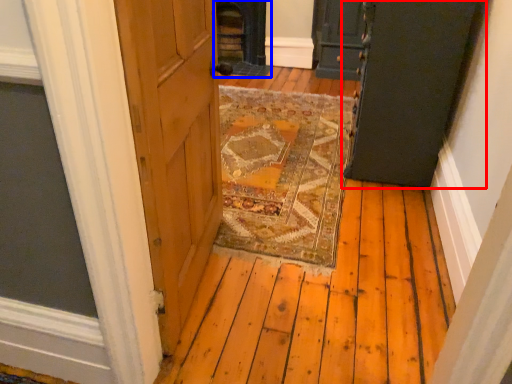
Question: Among these objects, which one is nearest to the camera, door (highlighted by a red box) or fireplace (highlighted by a blue box)?

Choices:
 (A) door
 (B) fireplace

Answer: (A)